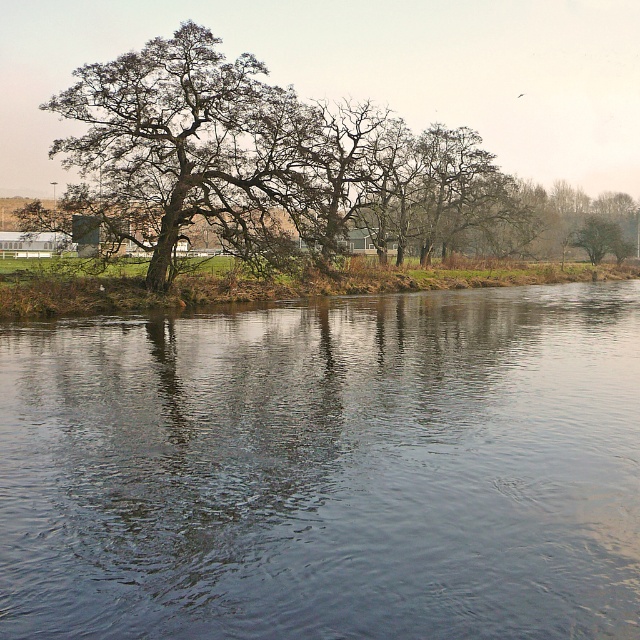
You are a painter setting up your easel to capture the riverside scene. You want to ensure that the smooth brown tree at right is taller than the dark blue water at center in your painting. Based on the scene, is this arrangement already present in the original image?

Yes, the smooth brown tree at right is taller than the dark blue water at center in the original image, so the arrangement is already present.

You are an artist planning to paint the riverside scene. You want to ensure the dark green textured oak tree at center and the smooth brown tree at right are proportionally accurate. Which tree should you paint larger in your artwork?

The dark green textured oak tree at center should be painted larger than the smooth brown tree at right because it is bigger in the scene.